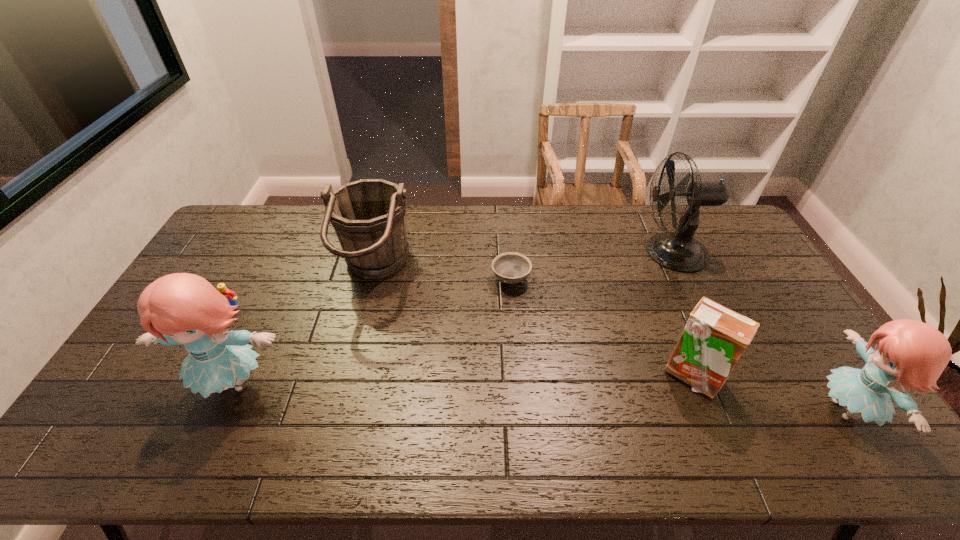
To make them evenly spaced by inserting another doll among them, please locate a vacant spot for this new doll. Please provide its 2D coordinates. Your answer should be formatted as a tuple, i.e. [(x, y)], where the tuple contains the x and y coordinates of a point satisfying the conditions above.

[(532, 396)]